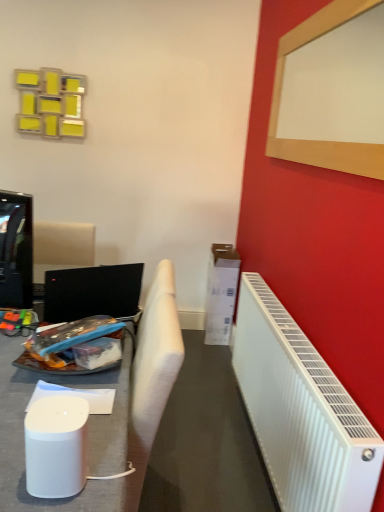
Question: Can we say black glossy television at left lies outside white fabric chair at left?

Choices:
 (A) no
 (B) yes

Answer: (B)

Question: Considering the relative positions of black glossy television at left and white fabric chair at left in the image provided, is black glossy television at left to the right of white fabric chair at left from the viewer's perspective?

Choices:
 (A) yes
 (B) no

Answer: (B)

Question: Is black glossy television at left aimed at white fabric chair at left?

Choices:
 (A) no
 (B) yes

Answer: (A)

Question: Is black glossy television at left smaller than white fabric chair at left?

Choices:
 (A) no
 (B) yes

Answer: (B)

Question: From the image's perspective, is black glossy television at left over white fabric chair at left?

Choices:
 (A) no
 (B) yes

Answer: (B)

Question: Relative to white fabric chair at left, is white plastic radiator at right in front or behind?

Choices:
 (A) front
 (B) behind

Answer: (A)

Question: Is white plastic radiator at right taller or shorter than white fabric chair at left?

Choices:
 (A) short
 (B) tall

Answer: (A)

Question: From a real-world perspective, is white plastic radiator at right positioned above or below white fabric chair at left?

Choices:
 (A) above
 (B) below

Answer: (B)

Question: Based on their sizes in the image, would you say white plastic radiator at right is bigger or smaller than white fabric chair at left?

Choices:
 (A) big
 (B) small

Answer: (B)

Question: From a real-world perspective, is white fabric chair at left above or below wooden frame at upper right?

Choices:
 (A) below
 (B) above

Answer: (A)

Question: From the image's perspective, is white fabric chair at left located above or below wooden frame at upper right?

Choices:
 (A) above
 (B) below

Answer: (B)

Question: Is point (173, 323) closer or farther from the camera than point (324, 138)?

Choices:
 (A) closer
 (B) farther

Answer: (A)

Question: Based on their positions, is white fabric chair at left located to the left or right of wooden frame at upper right?

Choices:
 (A) right
 (B) left

Answer: (B)

Question: Is wooden frame at upper right bigger or smaller than white fabric chair at left?

Choices:
 (A) big
 (B) small

Answer: (B)

Question: In the image, is wooden frame at upper right positioned in front of or behind white fabric chair at left?

Choices:
 (A) front
 (B) behind

Answer: (A)